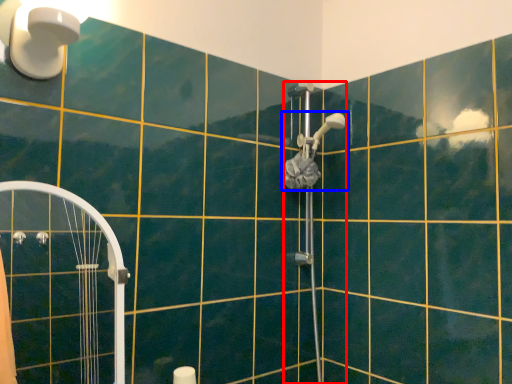
Question: Which point is closer to the camera, shower (highlighted by a red box) or shower (highlighted by a blue box)?

Choices:
 (A) shower
 (B) shower

Answer: (A)